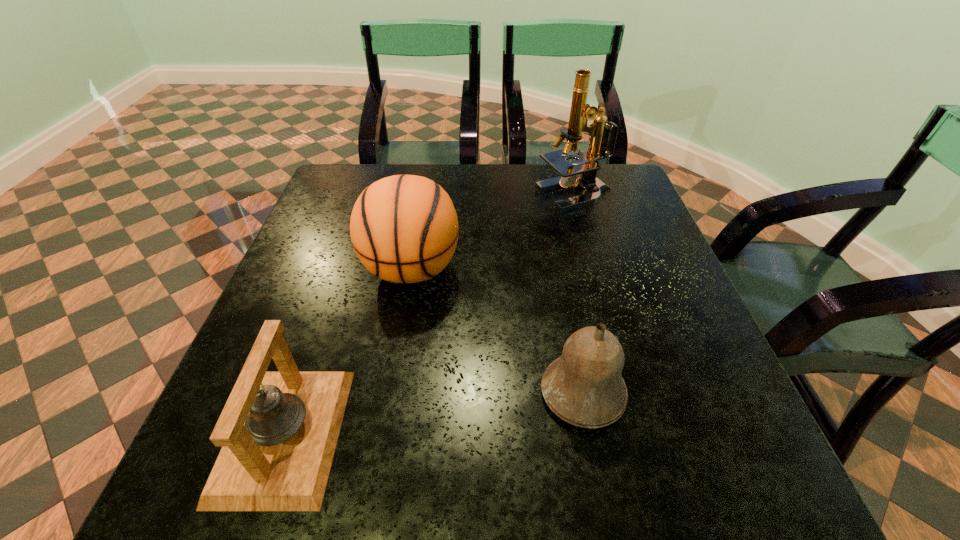
This screenshot has height=540, width=960. Identify the location of vacant region located 0.340m on the left of the right bell. (348, 393).

At what (x,y) coordinates should I click in order to perform the action: click on vacant region located 0.350m on the right of the left bell. Please return your answer as a coordinate pair (x, y). The width and height of the screenshot is (960, 540). Looking at the image, I should click on (554, 434).

The image size is (960, 540). In order to click on object located in the far edge section of the desktop in this screenshot , I will do `click(591, 187)`.

At what (x,y) coordinates should I click in order to perform the action: click on object present at the near edge. Please return your answer as a coordinate pair (x, y). Looking at the image, I should click on (278, 430).

Find the location of `object that is at the left edge`. object that is at the left edge is located at coordinates (278, 430).

At what (x,y) coordinates should I click in order to perform the action: click on object located in the right edge section of the desktop. Please return your answer as a coordinate pair (x, y). Looking at the image, I should click on 591,187.

This screenshot has height=540, width=960. Find the location of `object situated at the near left corner`. object situated at the near left corner is located at coordinates (278, 430).

You are a GUI agent. You are given a task and a screenshot of the screen. Output one action in this format:
    pyautogui.click(x=<x>, y=<y>)
    Task: Click on the object at the far right corner
    Image resolution: width=960 pixels, height=540 pixels.
    Given the screenshot: What is the action you would take?
    pyautogui.click(x=591, y=187)

The image size is (960, 540). I want to click on free space at the far edge of the desktop, so click(571, 194).

In order to click on vacant space at the near edge of the desktop in this screenshot , I will do `click(438, 500)`.